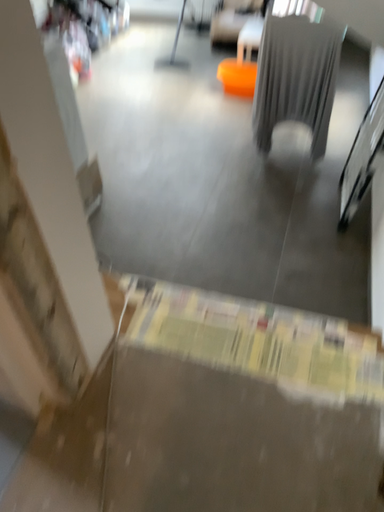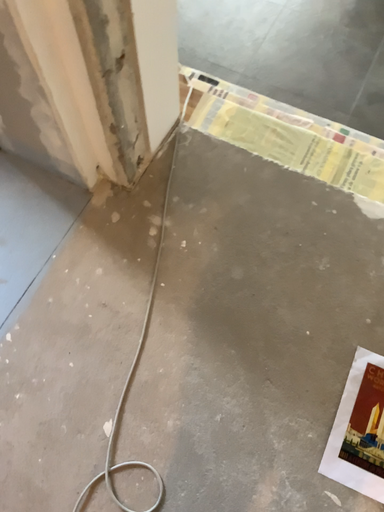
Question: Which way did the camera rotate in the video?

Choices:
 (A) rotated downward
 (B) rotated upward

Answer: (A)